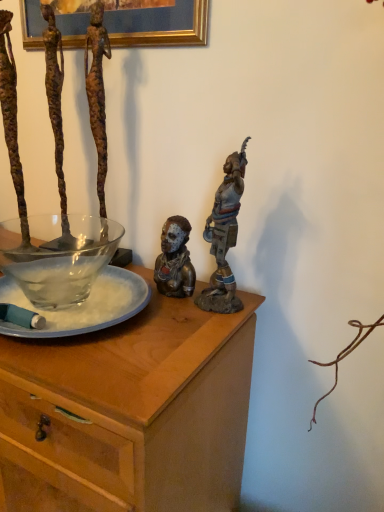
Identify the location of free space to the left of bronze statue at upper right, the first person in the right-to-left sequence. The image size is (384, 512). (166, 309).